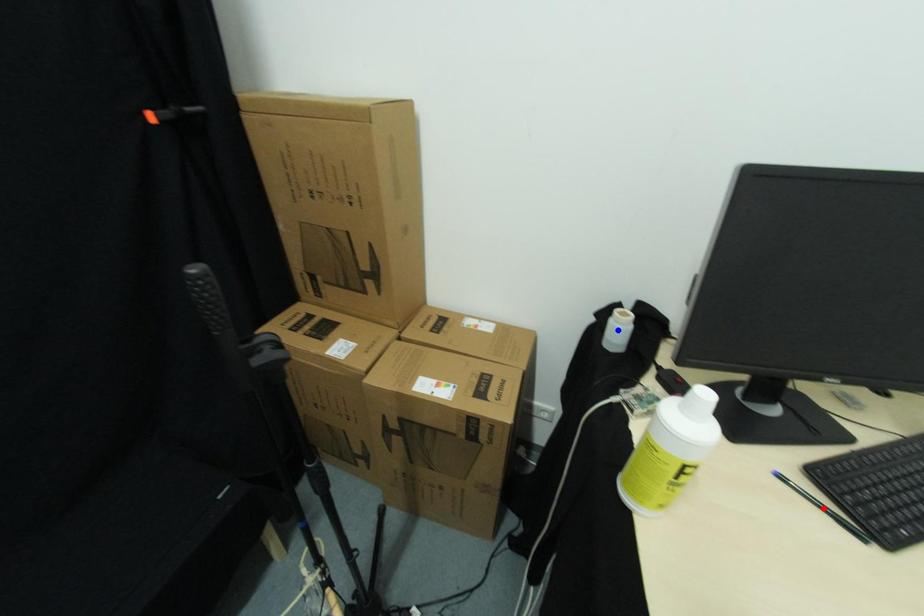
Question: Two points are marked on the image. Which point is closer to the camera?

Choices:
 (A) Blue point is closer.
 (B) Red point is closer.

Answer: (B)